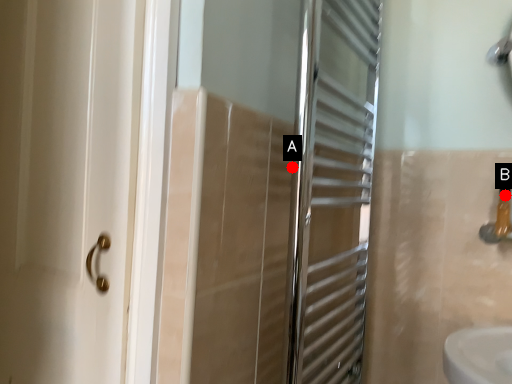
Question: Two points are circled on the image, labeled by A and B beside each circle. Which point is farther from the camera taking this photo?

Choices:
 (A) A is further
 (B) B is further

Answer: (B)